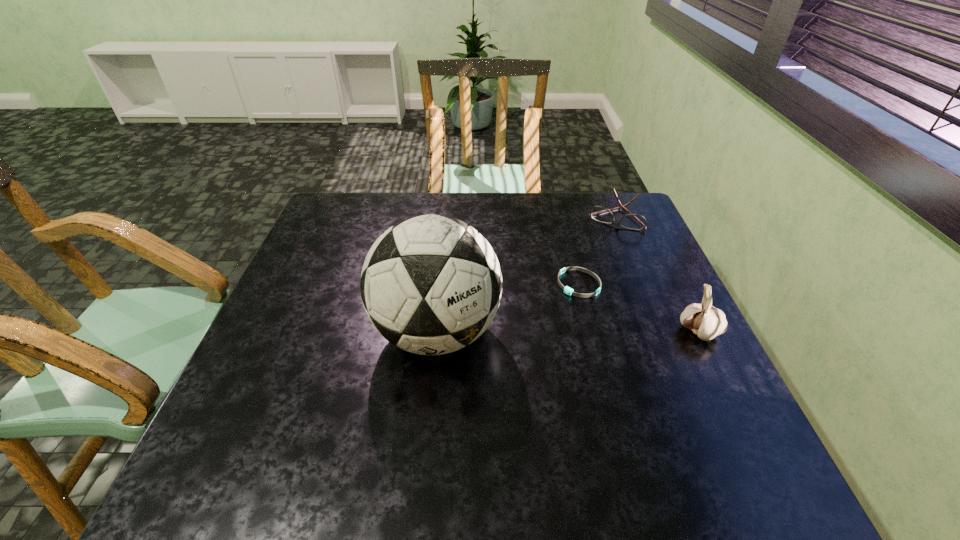
In order to click on vacant space located 0.150m on the front-facing side of the spectacles in this screenshot , I will do `click(595, 258)`.

Find the location of `free space located 0.120m on the buckle of the wristband`. free space located 0.120m on the buckle of the wristband is located at coordinates (547, 323).

The height and width of the screenshot is (540, 960). What are the coordinates of `blank space located 0.200m on the buckle of the wristband` in the screenshot? It's located at (531, 345).

The height and width of the screenshot is (540, 960). What are the coordinates of `vacant region located on the buckle of the wristband` in the screenshot? It's located at (549, 321).

This screenshot has width=960, height=540. In order to click on object at the far edge in this screenshot , I will do `click(600, 214)`.

The image size is (960, 540). I want to click on garlic at the right edge, so click(706, 321).

You are a GUI agent. You are given a task and a screenshot of the screen. Output one action in this format:
    pyautogui.click(x=<x>, y=<y>)
    Task: Click on the spectacles located at the right edge
    Image resolution: width=960 pixels, height=540 pixels.
    Given the screenshot: What is the action you would take?
    pyautogui.click(x=600, y=214)

What are the coordinates of `object at the far right corner` in the screenshot? It's located at (600, 214).

The width and height of the screenshot is (960, 540). Identify the location of free space at the far edge of the desktop. (483, 226).

The width and height of the screenshot is (960, 540). I want to click on free region at the near edge of the desktop, so click(x=450, y=423).